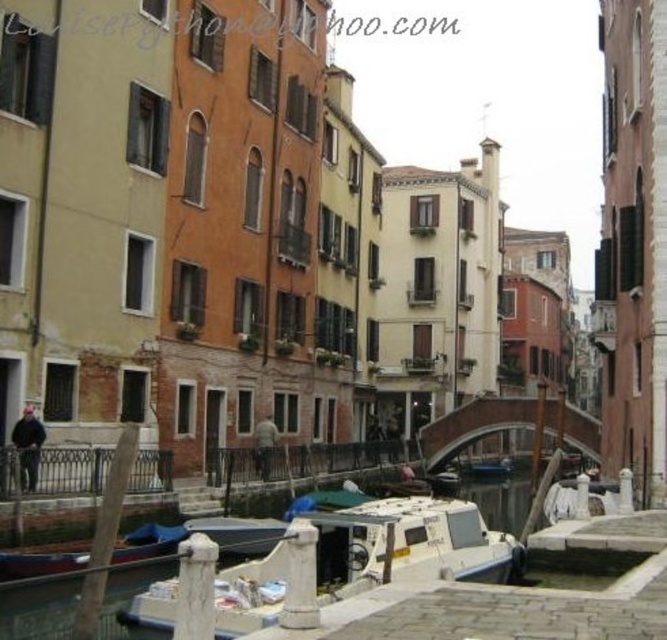
Is point (408, 548) positioned in front of point (466, 467)?

Yes, point (408, 548) is in front of point (466, 467).

Is white matte boat at center to the right of white plastic boat at center from the viewer's perspective?

No, white matte boat at center is not to the right of white plastic boat at center.

At what (x,y) coordinates should I click in order to perform the action: click on white matte boat at center. Please return your answer as a coordinate pair (x, y). Looking at the image, I should click on (410, 544).